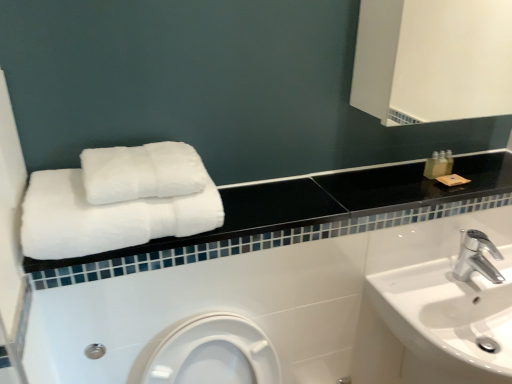
Where is `free location above white fluffy towels at center, acting as the 2th towel starting from the bottom (from a real-world perspective)`? free location above white fluffy towels at center, acting as the 2th towel starting from the bottom (from a real-world perspective) is located at coordinates (137, 151).